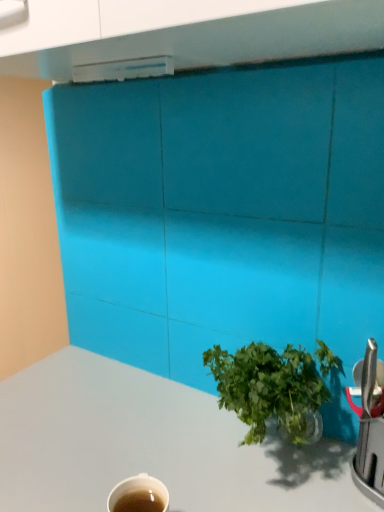
What do you see at coordinates (149, 445) in the screenshot? This screenshot has width=384, height=512. I see `white glossy counter top at center` at bounding box center [149, 445].

Where is `white glossy counter top at center`? The image size is (384, 512). white glossy counter top at center is located at coordinates (149, 445).

Locate an element on the screen. This screenshot has height=512, width=384. white glossy counter top at center is located at coordinates (149, 445).